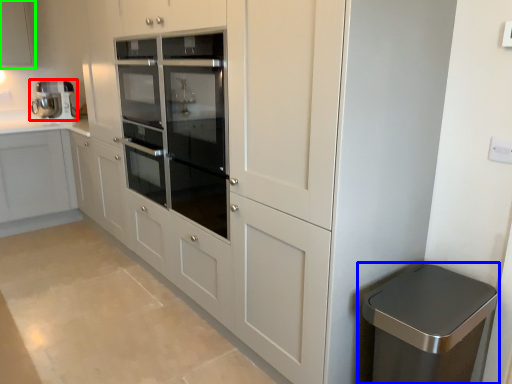
Question: Estimate the real-world distances between objects in this image. Which object is farther from home appliance (highlighted by a red box), waste container (highlighted by a blue box) or cabinetry (highlighted by a green box)?

Choices:
 (A) waste container
 (B) cabinetry

Answer: (A)